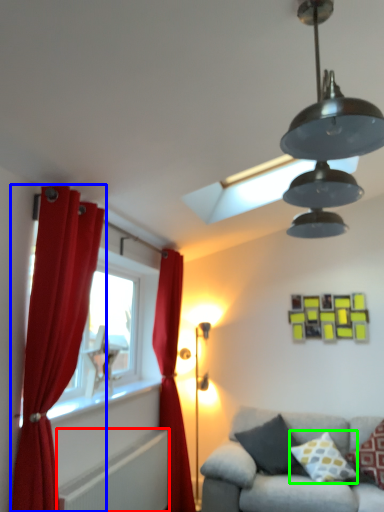
Question: Estimate the real-world distances between objects in this image. Which object is closer to radiator (highlighted by a red box), curtain (highlighted by a blue box) or pillow (highlighted by a green box)?

Choices:
 (A) curtain
 (B) pillow

Answer: (A)